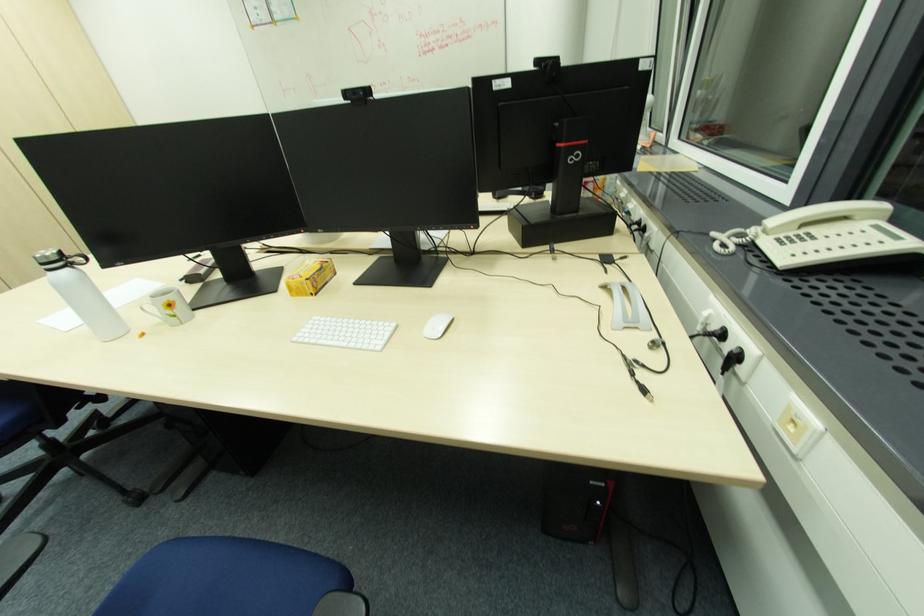
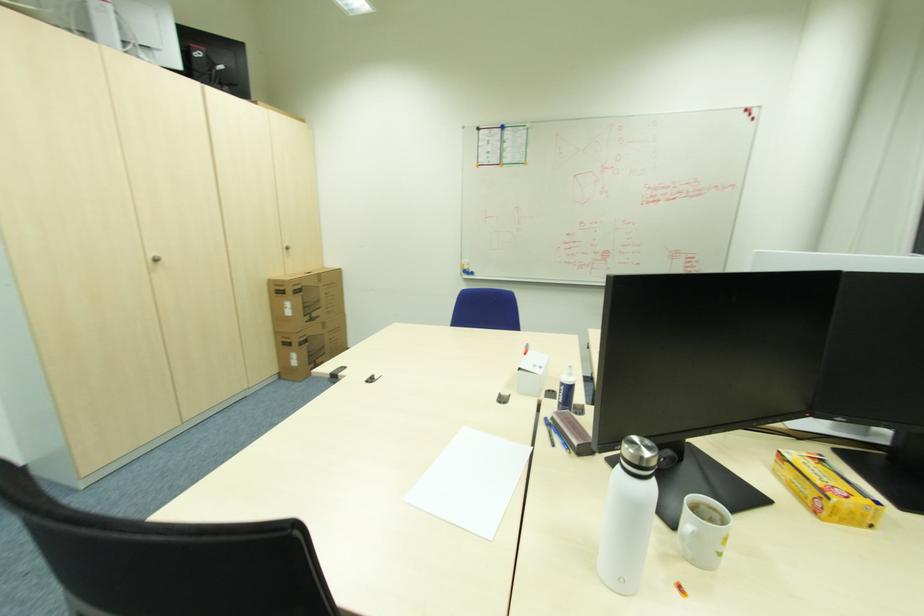
Question: What movement of the cameraman would produce the second image?

Choices:
 (A) Left
 (B) Right
 (C) Forward
 (D) Backward

Answer: (A)